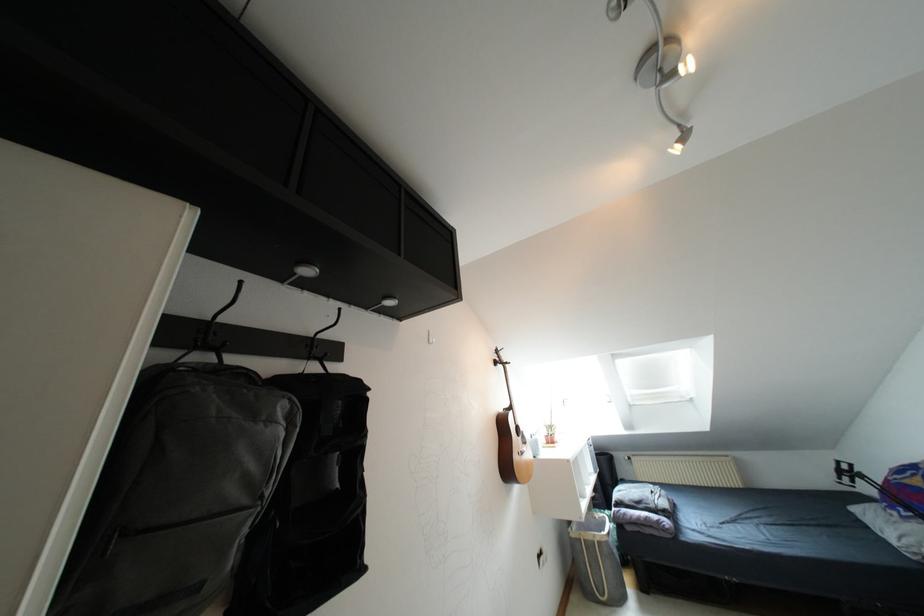
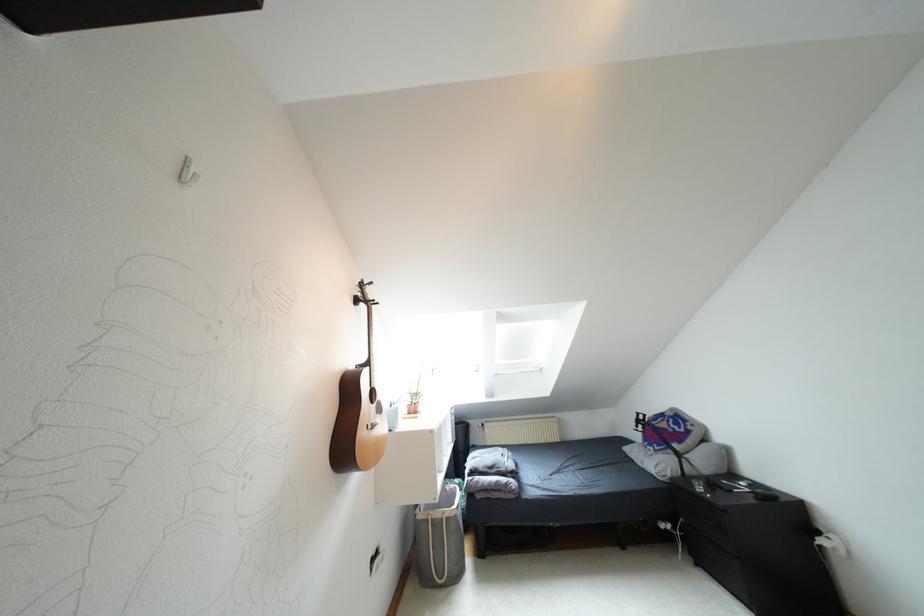
Question: Based on the continuous images, in which direction is the camera rotating? Reply with the corresponding letter.

Choices:
 (A) Left
 (B) Right
 (C) Up
 (D) Down

Answer: (B)